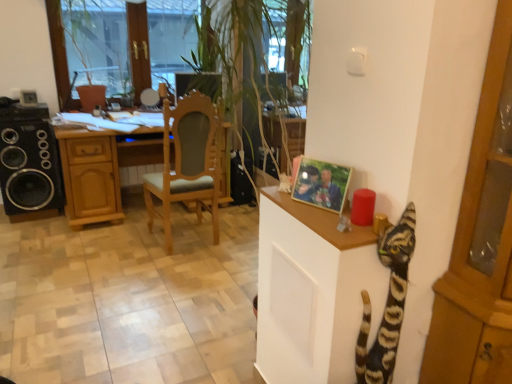
You are a GUI agent. You are given a task and a screenshot of the screen. Output one action in this format:
    pyautogui.click(x=<x>, y=<y>)
    Task: Click on the vacant area that is in front of wooden photo frame at upper right
    The height and width of the screenshot is (384, 512).
    Given the screenshot: What is the action you would take?
    pyautogui.click(x=326, y=223)